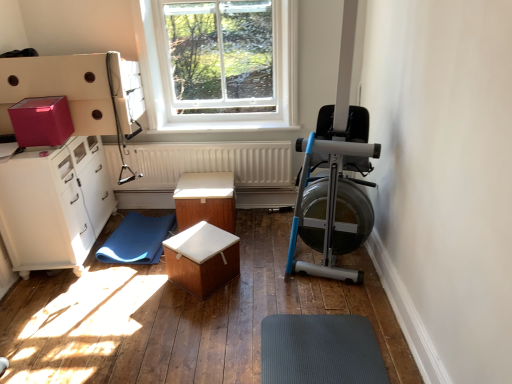
Identify the location of blank space situated above white textured radiator at center (from a real-world perspective). (188, 141).